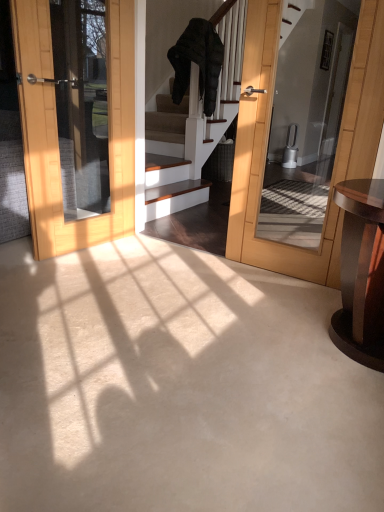
Question: Is dark wood table at right spatially inside dark gray puffer jacket at center, or outside of it?

Choices:
 (A) outside
 (B) inside

Answer: (A)

Question: In terms of size, does dark wood table at right appear bigger or smaller than dark gray puffer jacket at center?

Choices:
 (A) big
 (B) small

Answer: (B)

Question: Relative to dark gray puffer jacket at center, is dark wood table at right in front or behind?

Choices:
 (A) behind
 (B) front

Answer: (B)

Question: Considering the positions of dark gray puffer jacket at center and dark wood table at right in the image, is dark gray puffer jacket at center taller or shorter than dark wood table at right?

Choices:
 (A) tall
 (B) short

Answer: (A)

Question: Is dark gray puffer jacket at center bigger or smaller than dark wood table at right?

Choices:
 (A) small
 (B) big

Answer: (B)

Question: Does point (213, 83) appear closer or farther from the camera than point (370, 211)?

Choices:
 (A) farther
 (B) closer

Answer: (A)

Question: Looking at their shapes, would you say dark gray puffer jacket at center is wider or thinner than dark wood table at right?

Choices:
 (A) thin
 (B) wide

Answer: (A)